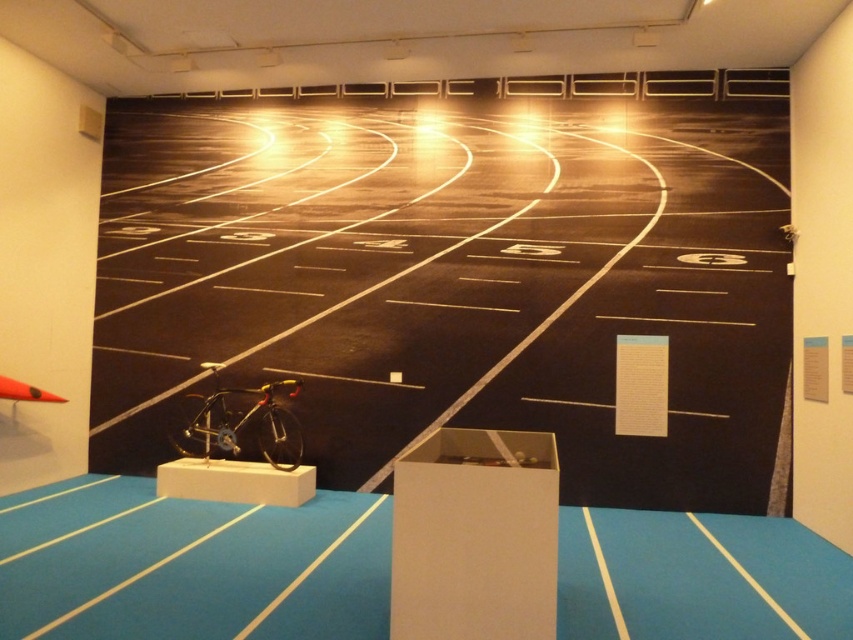
From the picture: Who is positioned more to the left, smooth asphalt race track at center or shiny metallic bicycle at center?

Positioned to the left is shiny metallic bicycle at center.

Between point (136, 195) and point (202, 413), which one is positioned behind?

The point (136, 195) is more distant.

Where is `smooth asphalt race track at center`? smooth asphalt race track at center is located at coordinates (453, 280).